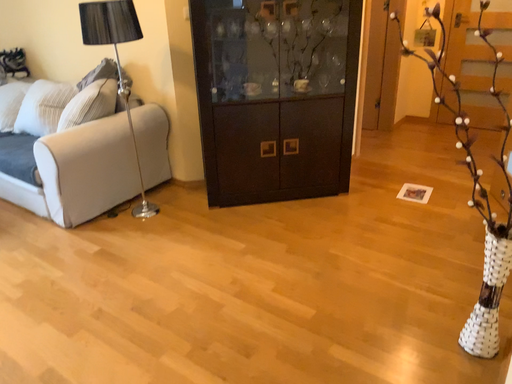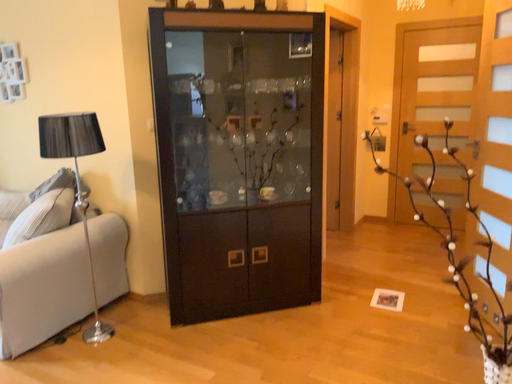
Question: Which way did the camera rotate in the video?

Choices:
 (A) rotated downward
 (B) rotated upward

Answer: (B)